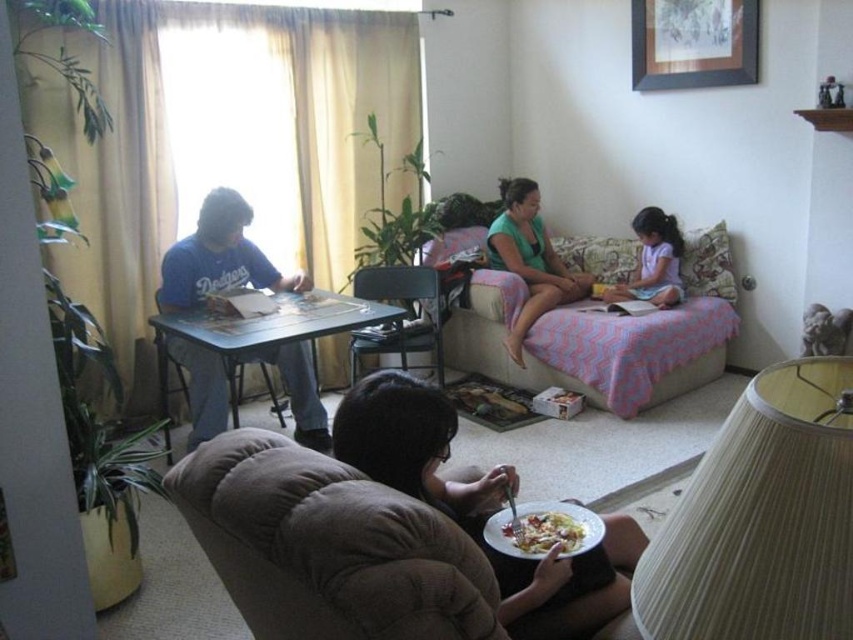
Based on the photo, measure the distance between point [527,278] and camera.

Point [527,278] and camera are 4.40 meters apart from each other.

Does green cotton shirt at center have a lesser height compared to pastel pink fabric at lower right?

In fact, green cotton shirt at center may be taller than pastel pink fabric at lower right.

Is point (532, 211) closer to viewer compared to point (618, 285)?

No, (532, 211) is behind (618, 285).

Identify the location of green cotton shirt at center. pos(529,259).

Can you confirm if brown fabric couch at lower center is positioned below matte black table at left?

Yes.

Based on the photo, measure the distance between brown fabric couch at lower center and matte black table at left.

A distance of 2.89 meters exists between brown fabric couch at lower center and matte black table at left.

This screenshot has width=853, height=640. What do you see at coordinates (339, 550) in the screenshot?
I see `brown fabric couch at lower center` at bounding box center [339, 550].

At what (x,y) coordinates should I click in order to perform the action: click on brown fabric couch at lower center. Please return your answer as a coordinate pair (x, y). This screenshot has height=640, width=853. Looking at the image, I should click on (339, 550).

This screenshot has width=853, height=640. What do you see at coordinates (529, 259) in the screenshot?
I see `green cotton shirt at center` at bounding box center [529, 259].

Between green cotton shirt at center and white glossy plate at lower center, which one appears on the left side from the viewer's perspective?

white glossy plate at lower center is more to the left.

Does point (543, 236) come closer to viewer compared to point (579, 524)?

No.

At what (x,y) coordinates should I click in order to perform the action: click on green cotton shirt at center. Please return your answer as a coordinate pair (x, y). This screenshot has width=853, height=640. Looking at the image, I should click on (529, 259).